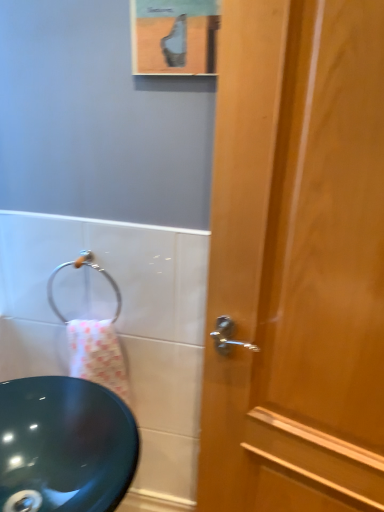
Measure the distance between matte black sink at left and camera.

matte black sink at left is 3.40 feet away from camera.

This screenshot has height=512, width=384. Describe the element at coordinates (79, 268) in the screenshot. I see `silver metallic towel ring at lower left` at that location.

This screenshot has height=512, width=384. In order to click on matte black sink at left in this screenshot , I will do `click(119, 327)`.

Is silver metallic towel ring at lower left facing towards wooden door at right?

No, silver metallic towel ring at lower left is not facing towards wooden door at right.

Can you confirm if silver metallic towel ring at lower left is wider than wooden door at right?

No.

Which is behind, point (119, 296) or point (374, 467)?

The point (119, 296) is more distant.

Is matte black sink at left in contact with wooden door at right?

No.

From the picture: Considering the positions of objects matte black sink at left and wooden door at right in the image provided, who is more to the left, matte black sink at left or wooden door at right?

Positioned to the left is matte black sink at left.

From the image's perspective, is matte black sink at left positioned above or below wooden door at right?

Based on their image positions, matte black sink at left is located beneath wooden door at right.

Looking at this image, is matte black sink at left in front of or behind wooden door at right in the image?

Clearly, matte black sink at left is behind wooden door at right.

In the scene shown: Is wooden door at right oriented towards matte black sink at left?

No, wooden door at right is not facing towards matte black sink at left.

From the image's perspective, is wooden door at right above or below matte black sink at left?

wooden door at right is situated higher than matte black sink at left in the image.

Is matte black sink at left completely or partially inside wooden door at right?

No, wooden door at right does not contain matte black sink at left.

Is wooden door at right in contact with matte black sink at left?

wooden door at right is not next to matte black sink at left, and they're not touching.

Considering the relative positions of matte black sink at left and silver metallic towel ring at lower left in the image provided, is matte black sink at left to the left of silver metallic towel ring at lower left from the viewer's perspective?

In fact, matte black sink at left is to the right of silver metallic towel ring at lower left.

Which is behind, point (49, 275) or point (117, 314)?

The point (117, 314) is farther.

Is matte black sink at left in front of or behind silver metallic towel ring at lower left in the image?

matte black sink at left is in front of silver metallic towel ring at lower left.

Is matte black sink at left positioned with its back to silver metallic towel ring at lower left?

Yes.

Which of these two, wooden door at right or silver metallic towel ring at lower left, stands taller?

wooden door at right.

Considering the sizes of objects wooden door at right and silver metallic towel ring at lower left in the image provided, who is thinner, wooden door at right or silver metallic towel ring at lower left?

silver metallic towel ring at lower left is thinner.

Which is closer to the camera, (x=311, y=263) or (x=115, y=282)?

The point (x=311, y=263) is in front.

Is silver metallic towel ring at lower left positioned far away from matte black sink at left?

silver metallic towel ring at lower left is near matte black sink at left, not far away.

From the picture: Could you tell me if silver metallic towel ring at lower left is turned towards matte black sink at left?

No, silver metallic towel ring at lower left is not turned towards matte black sink at left.

The height and width of the screenshot is (512, 384). What are the coordinates of `bath on the right side of silver metallic towel ring at lower left` in the screenshot? It's located at (119, 327).

Considering the sizes of silver metallic towel ring at lower left and matte black sink at left in the image, is silver metallic towel ring at lower left bigger or smaller than matte black sink at left?

silver metallic towel ring at lower left is smaller than matte black sink at left.

You are a GUI agent. You are given a task and a screenshot of the screen. Output one action in this format:
    pyautogui.click(x=<x>, y=<y>)
    Task: Click on the door below the silver metallic towel ring at lower left (from the image's perspective)
    
    Given the screenshot: What is the action you would take?
    pyautogui.click(x=296, y=261)

This screenshot has width=384, height=512. What are the coordinates of `bath behind the wooden door at right` in the screenshot? It's located at click(119, 327).

Considering their positions, is matte black sink at left positioned further to wooden door at right than silver metallic towel ring at lower left?

silver metallic towel ring at lower left is positioned further to the anchor wooden door at right.

Based on their spatial positions, is wooden door at right or silver metallic towel ring at lower left further from matte black sink at left?

wooden door at right.

Which object lies nearer to the anchor point silver metallic towel ring at lower left, wooden door at right or matte black sink at left?

Based on the image, matte black sink at left appears to be nearer to silver metallic towel ring at lower left.

From the picture: Looking at the image, which one is located closer to wooden door at right, silver metallic towel ring at lower left or matte black sink at left?

The object closer to wooden door at right is matte black sink at left.

From the image, which object appears to be farther from matte black sink at left, silver metallic towel ring at lower left or wooden door at right?

The object further to matte black sink at left is wooden door at right.

Which object lies further to the anchor point silver metallic towel ring at lower left, matte black sink at left or wooden door at right?

The object further to silver metallic towel ring at lower left is wooden door at right.

Find the location of a particular element. The height and width of the screenshot is (512, 384). bath between wooden door at right and silver metallic towel ring at lower left from front to back is located at coordinates (119, 327).